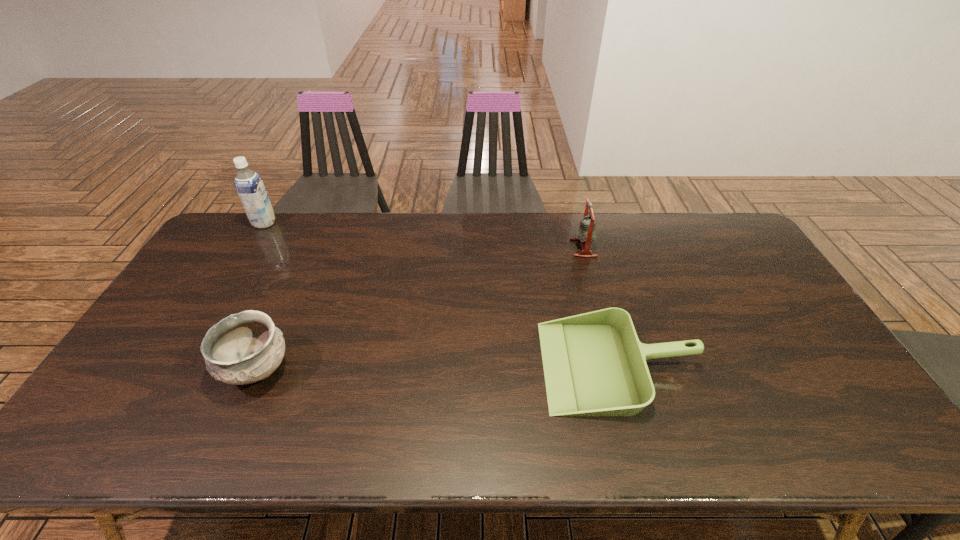
In the image, there is a desktop. Identify the location of free region at the left edge. (178, 313).

This screenshot has width=960, height=540. In the image, there is a desktop. In order to click on vacant space at the right edge in this screenshot , I will do click(748, 260).

In the image, there is a desktop. Where is `vacant space at the far left corner`? The width and height of the screenshot is (960, 540). vacant space at the far left corner is located at coordinates (217, 246).

At what (x,y) coordinates should I click in order to perform the action: click on vacant area at the near right corner of the desktop. Please return your answer as a coordinate pair (x, y). The height and width of the screenshot is (540, 960). Looking at the image, I should click on (828, 440).

In order to click on free space between the third tallest object and the third nearest object in this screenshot , I will do `click(420, 309)`.

You are a GUI agent. You are given a task and a screenshot of the screen. Output one action in this format:
    pyautogui.click(x=<x>, y=<y>)
    Task: Click on the free area in between the soya milk and the third shortest object
    
    Given the screenshot: What is the action you would take?
    pyautogui.click(x=424, y=235)

Locate an element on the screen. This screenshot has width=960, height=540. vacant space that's between the dustpan and the farthest object is located at coordinates (442, 294).

Where is `free space between the dustpan and the third shortest object`? This screenshot has width=960, height=540. free space between the dustpan and the third shortest object is located at coordinates (601, 307).

Locate an element on the screen. This screenshot has height=540, width=960. vacant region between the soya milk and the third shortest object is located at coordinates (424, 235).

You are a GUI agent. You are given a task and a screenshot of the screen. Output one action in this format:
    pyautogui.click(x=<x>, y=<y>)
    Task: Click on the free spot between the second tallest object and the shortest object
    The height and width of the screenshot is (540, 960).
    Given the screenshot: What is the action you would take?
    pyautogui.click(x=601, y=307)